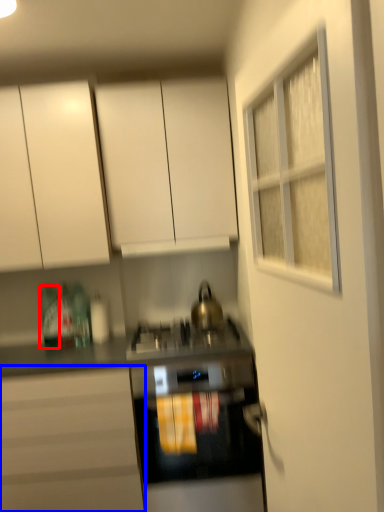
Question: Which point is further to the camera, bottle (highlighted by a red box) or cabinetry (highlighted by a blue box)?

Choices:
 (A) bottle
 (B) cabinetry

Answer: (A)